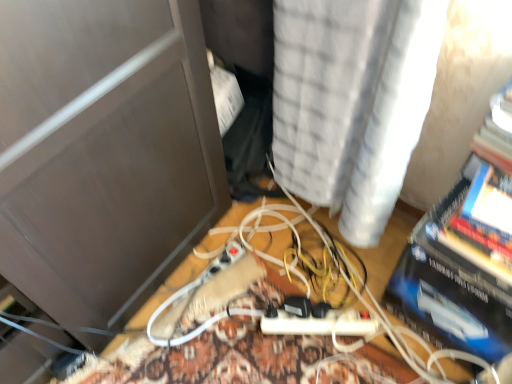
Where is `white textured curtain at upper center`? white textured curtain at upper center is located at coordinates (352, 102).

This screenshot has height=384, width=512. What do you see at coordinates (352, 102) in the screenshot? I see `white textured curtain at upper center` at bounding box center [352, 102].

In order to face white textured curtain at upper center, should I rotate leftwards or rightwards?

To align with it, rotate right about 12.227°.

Consider the image. Measure the distance between white textured curtain at upper center and camera.

63.61 centimeters.

Find the location of a particular element. Image resolution: width=512 pixels, height=384 pixels. blue glossy paperback book at right is located at coordinates (465, 252).

What do you see at coordinates (465, 252) in the screenshot? This screenshot has width=512, height=384. I see `blue glossy paperback book at right` at bounding box center [465, 252].

At what (x,y) coordinates should I click in order to perform the action: click on white textured curtain at upper center. Please return your answer as a coordinate pair (x, y). This screenshot has height=384, width=512. Looking at the image, I should click on (352, 102).

Is white textured curtain at upper center to the right of blue glossy paperback book at right from the viewer's perspective?

Incorrect, white textured curtain at upper center is not on the right side of blue glossy paperback book at right.

Which object is more forward, white textured curtain at upper center or blue glossy paperback book at right?

white textured curtain at upper center is in front.

Considering the points (401, 53) and (470, 260), which point is behind, point (401, 53) or point (470, 260)?

Point (470, 260)

From the image's perspective, which one is positioned lower, white textured curtain at upper center or blue glossy paperback book at right?

blue glossy paperback book at right, from the image's perspective.

From a real-world perspective, does white textured curtain at upper center stand above blue glossy paperback book at right?

Yes, from a real-world perspective, white textured curtain at upper center is on top of blue glossy paperback book at right.

Considering the sizes of objects white textured curtain at upper center and blue glossy paperback book at right in the image provided, who is wider, white textured curtain at upper center or blue glossy paperback book at right?

white textured curtain at upper center is wider.

Between white textured curtain at upper center and blue glossy paperback book at right, which one has less height?

Standing shorter between the two is blue glossy paperback book at right.

Considering the relative sizes of white textured curtain at upper center and blue glossy paperback book at right in the image provided, is white textured curtain at upper center bigger than blue glossy paperback book at right?

Yes, white textured curtain at upper center is bigger than blue glossy paperback book at right.

Consider the image. Is white textured curtain at upper center completely or partially outside of blue glossy paperback book at right?

white textured curtain at upper center is positioned outside blue glossy paperback book at right.

Would you consider white textured curtain at upper center to be distant from blue glossy paperback book at right?

No, white textured curtain at upper center is not far from blue glossy paperback book at right.

Is white textured curtain at upper center facing away from blue glossy paperback book at right?

No.

What's the angular difference between white textured curtain at upper center and blue glossy paperback book at right's facing directions?

3.56 degrees.

You are a GUI agent. You are given a task and a screenshot of the screen. Output one action in this format:
    pyautogui.click(x=<x>, y=<y>)
    Task: Click on the curtain in front of the blue glossy paperback book at right
    The height and width of the screenshot is (384, 512).
    Given the screenshot: What is the action you would take?
    pyautogui.click(x=352, y=102)

In the scene shown: Considering the relative positions of blue glossy paperback book at right and white textured curtain at upper center in the image provided, is blue glossy paperback book at right to the left or to the right of white textured curtain at upper center?

From the image, it's evident that blue glossy paperback book at right is to the right of white textured curtain at upper center.

Is blue glossy paperback book at right closer to camera compared to white textured curtain at upper center?

No.

Is point (418, 230) closer or farther from the camera than point (422, 54)?

Point (418, 230) appears to be farther away from the viewer than point (422, 54).

From the image's perspective, is blue glossy paperback book at right located above white textured curtain at upper center?

Actually, blue glossy paperback book at right appears below white textured curtain at upper center in the image.

From a real-world perspective, is blue glossy paperback book at right positioned above or below white textured curtain at upper center?

In terms of real-world spatial position, blue glossy paperback book at right is below white textured curtain at upper center.

Which of these two, blue glossy paperback book at right or white textured curtain at upper center, is wider?

white textured curtain at upper center is wider.

Is blue glossy paperback book at right shorter than white textured curtain at upper center?

Correct, blue glossy paperback book at right is not as tall as white textured curtain at upper center.

Considering the sizes of objects blue glossy paperback book at right and white textured curtain at upper center in the image provided, who is smaller, blue glossy paperback book at right or white textured curtain at upper center?

blue glossy paperback book at right.

Is white textured curtain at upper center inside blue glossy paperback book at right?

No, white textured curtain at upper center is not surrounded by blue glossy paperback book at right.

Would you consider blue glossy paperback book at right to be distant from white textured curtain at upper center?

No, blue glossy paperback book at right is in close proximity to white textured curtain at upper center.

Is blue glossy paperback book at right looking in the opposite direction of white textured curtain at upper center?

blue glossy paperback book at right is not turned away from white textured curtain at upper center.

Measure the distance from blue glossy paperback book at right to white textured curtain at upper center.

blue glossy paperback book at right and white textured curtain at upper center are 25.51 centimeters apart from each other.

The height and width of the screenshot is (384, 512). What are the coordinates of `paperback book on the right of white textured curtain at upper center` in the screenshot? It's located at [465, 252].

Locate an element on the screen. paperback book behind the white textured curtain at upper center is located at coordinates (465, 252).

Identify the location of curtain above the blue glossy paperback book at right (from the image's perspective). (352, 102).